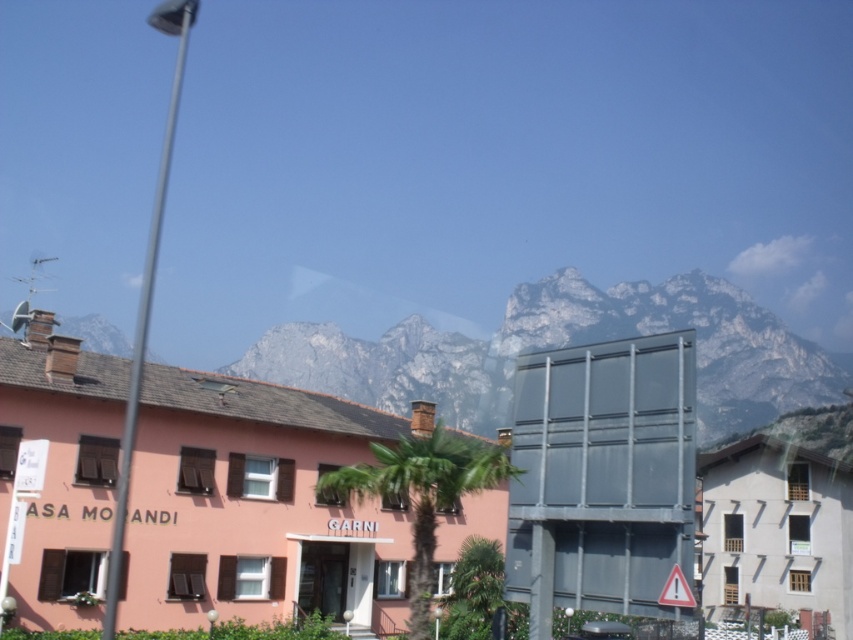
Does point (41, 342) come farther from viewer compared to point (827, 541)?

No.

Consider the image. Can you confirm if pink matte building at center is thinner than white wooden building at lower right?

No, pink matte building at center is not thinner than white wooden building at lower right.

Which is in front, point (167, 381) or point (734, 618)?

Point (167, 381) is in front.

What are the coordinates of `pink matte building at center` in the screenshot? It's located at (257, 506).

Is white rocky mountain at upper center to the right of white wooden building at lower right from the viewer's perspective?

In fact, white rocky mountain at upper center is to the left of white wooden building at lower right.

Can you confirm if white rocky mountain at upper center is shorter than white wooden building at lower right?

No, white rocky mountain at upper center is not shorter than white wooden building at lower right.

Is point (556, 332) closer to camera compared to point (712, 588)?

That is False.

This screenshot has height=640, width=853. I want to click on white rocky mountain at upper center, so click(x=579, y=342).

The image size is (853, 640). Describe the element at coordinates (602, 476) in the screenshot. I see `metallic gray billboard at center` at that location.

Does metallic gray billboard at center appear on the right side of white wooden building at lower right?

In fact, metallic gray billboard at center is to the left of white wooden building at lower right.

Locate an element on the screen. This screenshot has width=853, height=640. metallic gray billboard at center is located at coordinates (602, 476).

You are a GUI agent. You are given a task and a screenshot of the screen. Output one action in this format:
    pyautogui.click(x=<x>, y=<y>)
    Task: Click on the metallic gray billboard at center
    Image resolution: width=853 pixels, height=640 pixels.
    Given the screenshot: What is the action you would take?
    pyautogui.click(x=602, y=476)